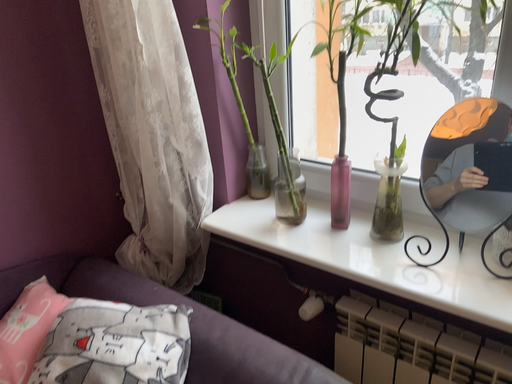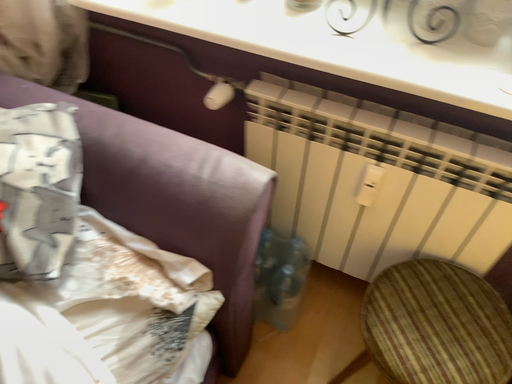
Question: How did the camera likely rotate when shooting the video?

Choices:
 (A) rotated downward
 (B) rotated upward

Answer: (A)